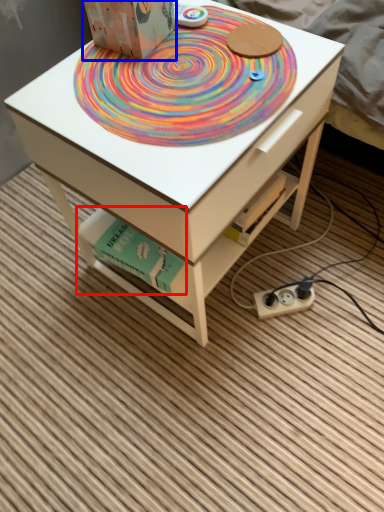
Question: Which of the following is the closest to the observer, book (highlighted by a red box) or cardboard box (highlighted by a blue box)?

Choices:
 (A) book
 (B) cardboard box

Answer: (B)